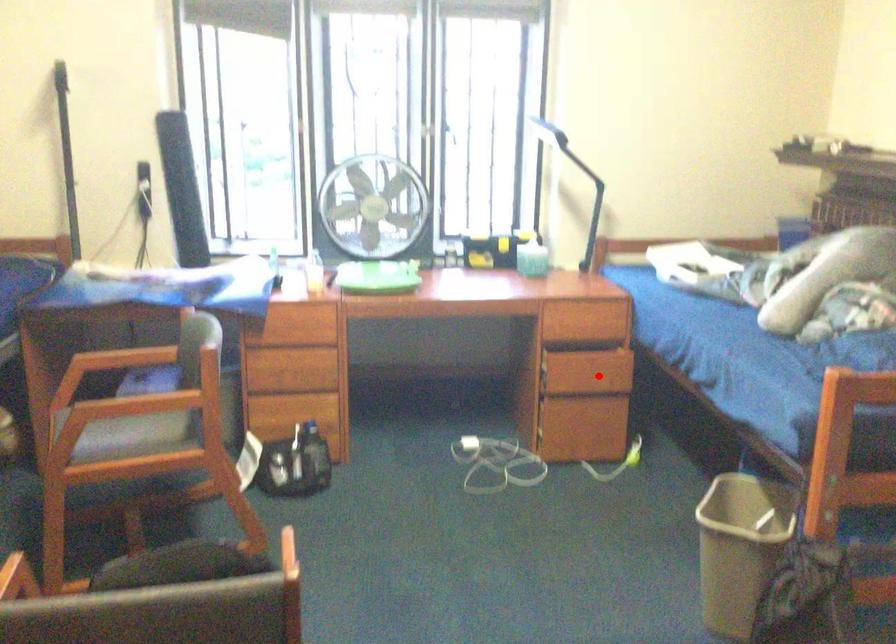
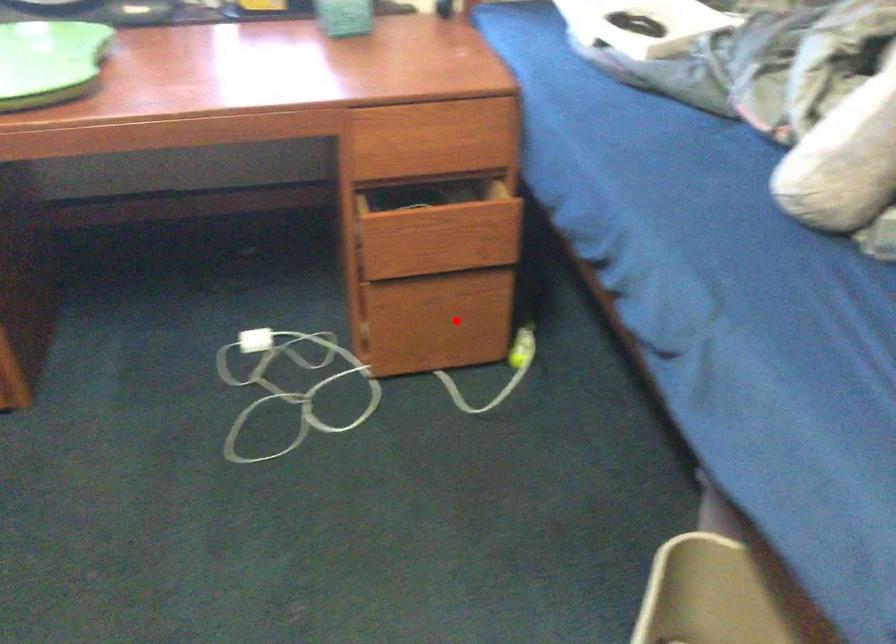
I am providing you with two images of the same scene from different viewpoints. A red point is marked on the first image and another point is marked on the second image. Do the highlighted points in image1 and image2 indicate the same real-world spot?

No